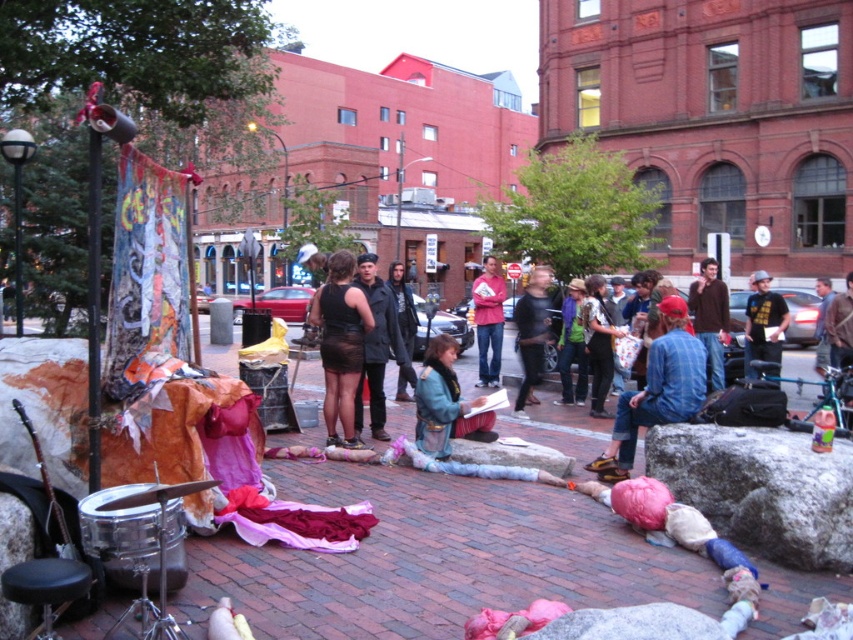
Question: Based on their relative distances, which object is nearer to the dark gray wool coat at center?

Choices:
 (A) black sheer skirt at center
 (B) denim jacket at center

Answer: (A)

Question: Among these objects, which one is nearest to the camera?

Choices:
 (A) blue denim jacket at center
 (B) black t-shirt at center
 (C) denim jacket at center

Answer: (C)

Question: Considering the relative positions of pink fabric at center and denim jacket at center in the image provided, where is pink fabric at center located with respect to denim jacket at center?

Choices:
 (A) below
 (B) above

Answer: (A)

Question: Is blue denim jacket at center bigger than pink fabric at center?

Choices:
 (A) no
 (B) yes

Answer: (A)

Question: Which of the following is the closest to the observer?

Choices:
 (A) (498, 320)
 (B) (341, 292)
 (C) (601, 436)

Answer: (B)

Question: Does blue denim jacket at center appear on the left side of dark gray wool coat at center?

Choices:
 (A) no
 (B) yes

Answer: (A)